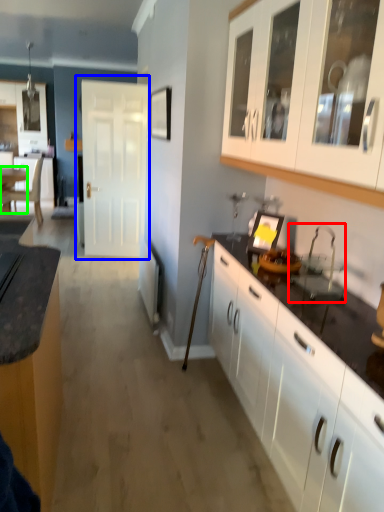
Question: Considering the real-world distances, which object is farthest from sink (highlighted by a red box)? door (highlighted by a blue box) or table (highlighted by a green box)?

Choices:
 (A) door
 (B) table

Answer: (B)